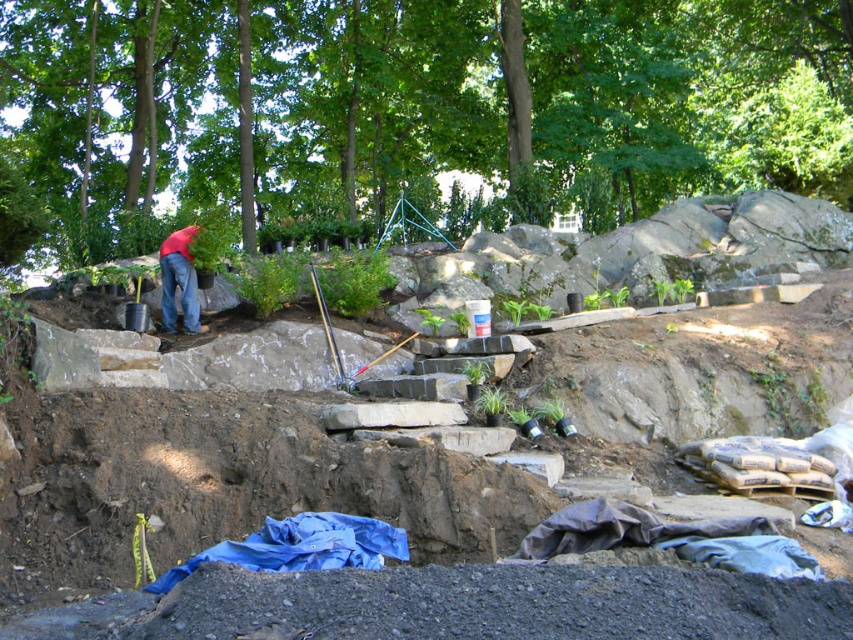
Consider the image. You are a construction worker who needs to move a heavy equipment from the natural stone steps at upper center to the jeans at left. Which area has more space to accommodate the equipment?

The jeans at left has more space than the natural stone steps at upper center, so the equipment can be moved there.